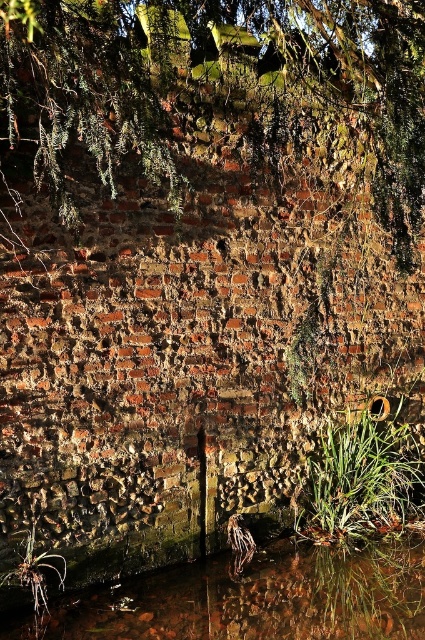
Question: Considering the real-world distances, which object is closest to the brown/rough water at lower center?

Choices:
 (A) green leafy tree at upper center
 (B) green fibrous weed at lower left

Answer: (B)

Question: Is brown/rough water at lower center below green fibrous weed at lower left?

Choices:
 (A) no
 (B) yes

Answer: (B)

Question: Which point appears farthest from the camera in this image?

Choices:
 (A) (22, 563)
 (B) (224, 0)

Answer: (B)

Question: Is green leafy tree at upper center wider than brown/rough water at lower center?

Choices:
 (A) no
 (B) yes

Answer: (A)

Question: Can you confirm if green leafy tree at upper center is bigger than green fibrous weed at lower left?

Choices:
 (A) yes
 (B) no

Answer: (A)

Question: Which object is positioned farthest from the brown/rough water at lower center?

Choices:
 (A) green fibrous weed at lower left
 (B) green leafy tree at upper center

Answer: (B)